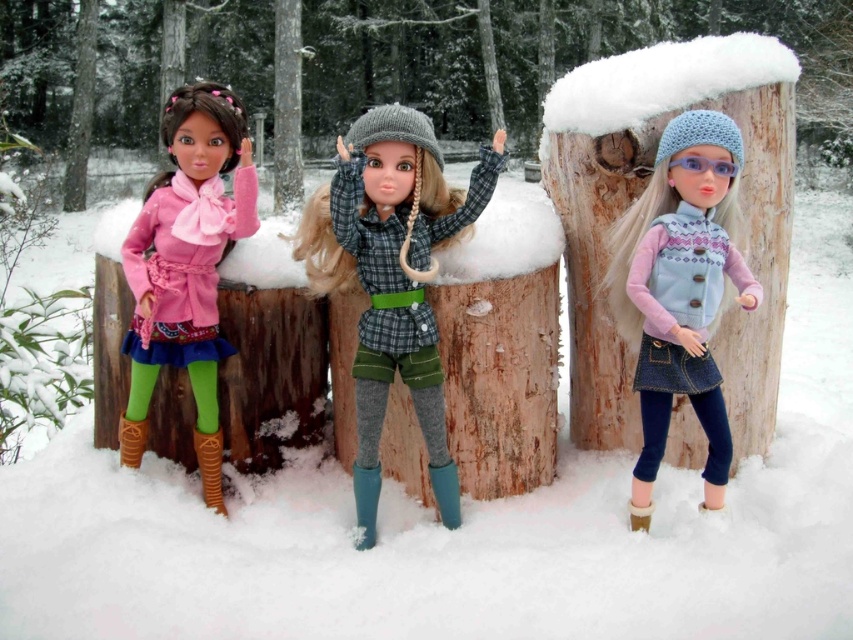
Question: Can you confirm if denim skirt at center is positioned to the left of matte pink coat at left?

Choices:
 (A) yes
 (B) no

Answer: (B)

Question: Which of these objects is positioned farthest from the checkered fabric shirt at center?

Choices:
 (A) matte pink coat at left
 (B) denim skirt at center

Answer: (B)

Question: Which point is farther to the camera?

Choices:
 (A) matte pink coat at left
 (B) denim skirt at center
 (C) brown wood tree trunk at center

Answer: (C)

Question: Can you confirm if checkered fabric shirt at center is thinner than brown wood tree trunk at center?

Choices:
 (A) no
 (B) yes

Answer: (A)

Question: Which point is closer to the camera taking this photo?

Choices:
 (A) (720, 481)
 (B) (216, 340)
 (C) (277, 134)
 (D) (431, 310)

Answer: (D)

Question: Observing the image, what is the correct spatial positioning of checkered fabric shirt at center in reference to denim skirt at center?

Choices:
 (A) left
 (B) right

Answer: (A)